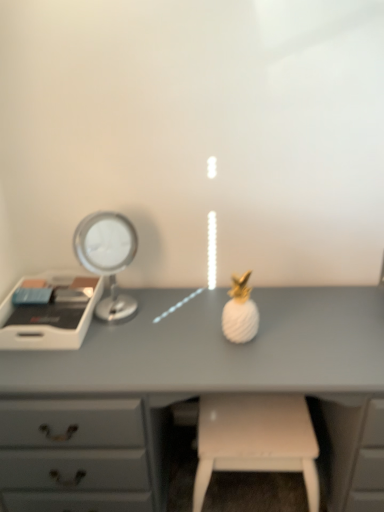
Identify the location of vacant area that is situated to the right of silver metallic mirror at left. (172, 314).